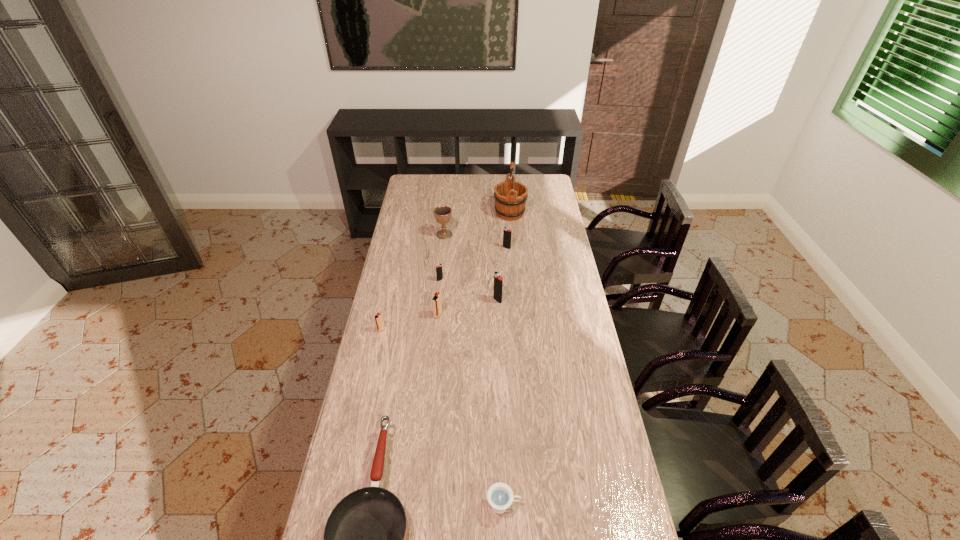
Identify the location of the farthest object. Image resolution: width=960 pixels, height=540 pixels. (510, 197).

Locate an element on the screen. wood wine bucket is located at coordinates (510, 197).

What are the coordinates of `the fifth farthest object` in the screenshot? It's located at (498, 280).

Locate an element on the screen. The height and width of the screenshot is (540, 960). the third farthest igniter is located at coordinates (498, 280).

The width and height of the screenshot is (960, 540). What are the coordinates of `chalice` in the screenshot? It's located at (442, 214).

Identify the location of brown chalice. The height and width of the screenshot is (540, 960). (442, 214).

Find the location of a particular element. The width and height of the screenshot is (960, 540). the farthest igniter is located at coordinates (507, 232).

This screenshot has height=540, width=960. Find the location of `the farthest black igniter`. the farthest black igniter is located at coordinates (507, 232).

Locate an element on the screen. This screenshot has width=960, height=540. the farther red igniter is located at coordinates (436, 300).

The height and width of the screenshot is (540, 960). Find the location of `the right red igniter`. the right red igniter is located at coordinates (436, 300).